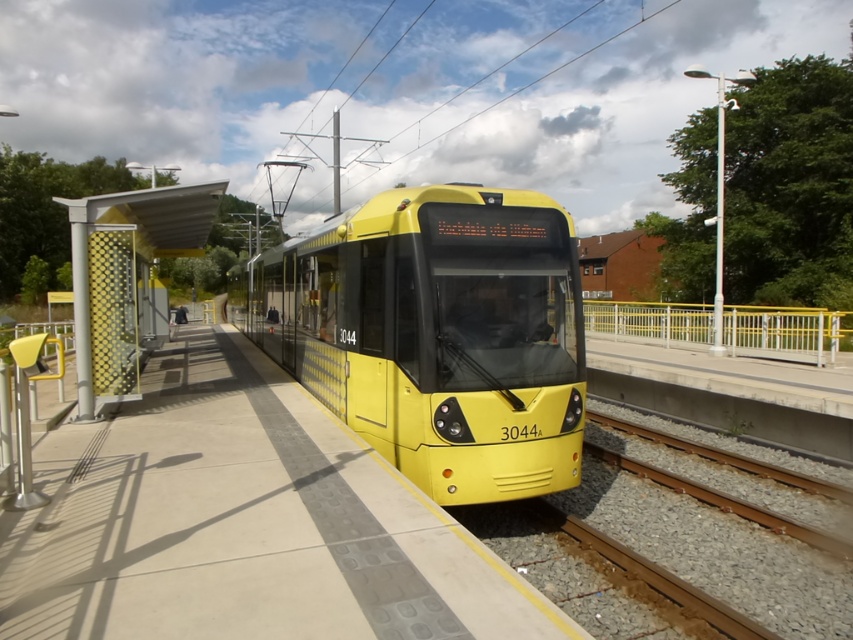
Question: In this image, where is smooth concrete platform at center located relative to yellow metal railing at right?

Choices:
 (A) below
 (B) above

Answer: (A)

Question: Which point is farther to the camera?

Choices:
 (A) yellow mesh screen at left
 (B) smooth concrete platform at center
 (C) yellow matte train at center
 (D) yellow metal railing at right

Answer: (D)

Question: Which point appears farthest from the camera in this image?

Choices:
 (A) (136, 193)
 (B) (753, 305)

Answer: (B)

Question: Is yellow matte train at center further to the viewer compared to yellow mesh screen at left?

Choices:
 (A) yes
 (B) no

Answer: (B)

Question: Which is farther from the yellow mesh screen at left?

Choices:
 (A) yellow metal railing at right
 (B) smooth concrete platform at center

Answer: (A)

Question: Can you confirm if smooth concrete platform at center is wider than yellow matte train at center?

Choices:
 (A) no
 (B) yes

Answer: (A)